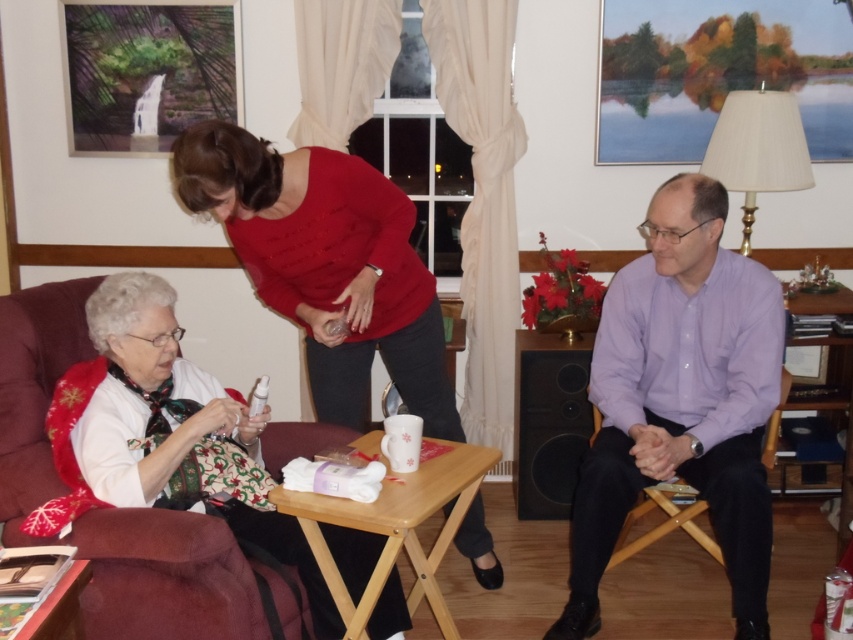
Can you confirm if matte red sweater at center is smaller than white fabric at left?

Actually, matte red sweater at center might be larger than white fabric at left.

Between matte red sweater at center and white fabric at left, which one has more height?

matte red sweater at center

Is point (317, 250) in front of point (111, 294)?

No, it is not.

Where is `matte red sweater at center`? This screenshot has width=853, height=640. matte red sweater at center is located at coordinates pyautogui.click(x=328, y=266).

Can you confirm if purple smooth shirt at center is smaller than matte red sweater at center?

Indeed, purple smooth shirt at center has a smaller size compared to matte red sweater at center.

At what (x,y) coordinates should I click in order to perform the action: click on purple smooth shirt at center. Please return your answer as a coordinate pair (x, y). This screenshot has width=853, height=640. Looking at the image, I should click on (682, 397).

Where is `purple smooth shirt at center`? purple smooth shirt at center is located at coordinates (682, 397).

Is point (735, 440) positioned after point (86, 422)?

That is True.

Where is `purple smooth shirt at center`? purple smooth shirt at center is located at coordinates (682, 397).